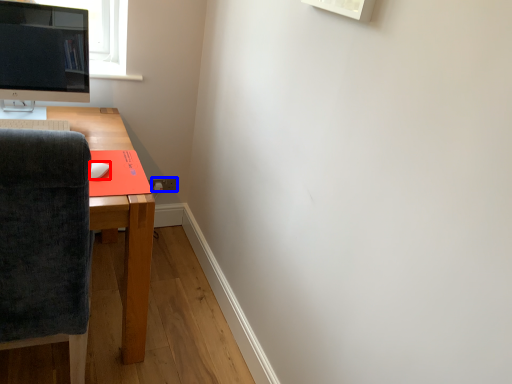
Question: Which point is further to the camera, mouse (highlighted by a red box) or power outlet (highlighted by a blue box)?

Choices:
 (A) mouse
 (B) power outlet

Answer: (B)